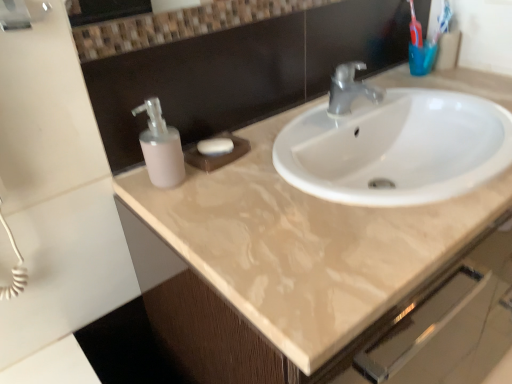
Question: Considering the relative sizes of blue plastic toothbrush at upper right and matte plastic soap dispenser at left in the image provided, is blue plastic toothbrush at upper right shorter than matte plastic soap dispenser at left?

Choices:
 (A) yes
 (B) no

Answer: (A)

Question: Is blue plastic toothbrush at upper right further to the viewer compared to matte plastic soap dispenser at left?

Choices:
 (A) no
 (B) yes

Answer: (B)

Question: Can you confirm if blue plastic toothbrush at upper right is thinner than matte plastic soap dispenser at left?

Choices:
 (A) yes
 (B) no

Answer: (A)

Question: From the image's perspective, does blue plastic toothbrush at upper right appear lower than matte plastic soap dispenser at left?

Choices:
 (A) no
 (B) yes

Answer: (A)

Question: From a real-world perspective, does blue plastic toothbrush at upper right sit lower than matte plastic soap dispenser at left?

Choices:
 (A) no
 (B) yes

Answer: (A)

Question: Is blue plastic toothbrush at upper right wider or thinner than beige glossy sink at upper center?

Choices:
 (A) wide
 (B) thin

Answer: (B)

Question: From the image's perspective, is blue plastic toothbrush at upper right above or below beige glossy sink at upper center?

Choices:
 (A) above
 (B) below

Answer: (A)

Question: Is blue plastic toothbrush at upper right in front of or behind beige glossy sink at upper center in the image?

Choices:
 (A) behind
 (B) front

Answer: (A)

Question: Considering the positions of blue plastic toothbrush at upper right and beige glossy sink at upper center in the image, is blue plastic toothbrush at upper right bigger or smaller than beige glossy sink at upper center?

Choices:
 (A) small
 (B) big

Answer: (A)

Question: Is beige glossy sink at upper center wider or thinner than white matte soap at center?

Choices:
 (A) thin
 (B) wide

Answer: (B)

Question: Visually, is beige glossy sink at upper center positioned to the left or to the right of white matte soap at center?

Choices:
 (A) left
 (B) right

Answer: (B)

Question: From a real-world perspective, is beige glossy sink at upper center positioned above or below white matte soap at center?

Choices:
 (A) below
 (B) above

Answer: (A)

Question: From their relative heights in the image, would you say beige glossy sink at upper center is taller or shorter than white matte soap at center?

Choices:
 (A) tall
 (B) short

Answer: (A)

Question: Considering the positions of matte plastic soap dispenser at left and beige glossy sink at upper center in the image, is matte plastic soap dispenser at left bigger or smaller than beige glossy sink at upper center?

Choices:
 (A) big
 (B) small

Answer: (B)

Question: Is matte plastic soap dispenser at left in front of or behind beige glossy sink at upper center in the image?

Choices:
 (A) behind
 (B) front

Answer: (A)